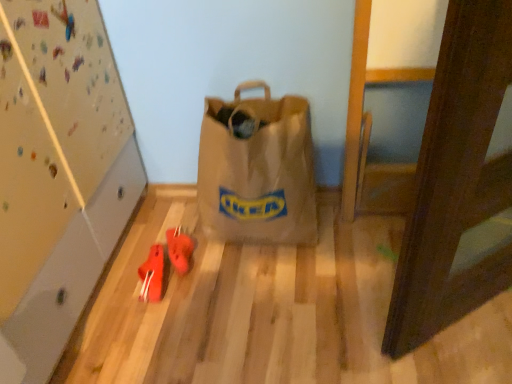
Question: Is brown paper bag at center taller than rubberized red shoes at lower left, acting as the 2th footwear starting from the right?

Choices:
 (A) no
 (B) yes

Answer: (B)

Question: Considering the relative sizes of brown paper bag at center and rubberized red shoes at lower left, the first footwear when ordered from left to right, in the image provided, is brown paper bag at center smaller than rubberized red shoes at lower left, the first footwear when ordered from left to right,?

Choices:
 (A) no
 (B) yes

Answer: (A)

Question: From the image's perspective, is brown paper bag at center beneath rubberized red shoes at lower left, acting as the 2th footwear starting from the right?

Choices:
 (A) yes
 (B) no

Answer: (B)

Question: Considering the relative positions of brown paper bag at center and rubberized red shoes at lower left, acting as the 2th footwear starting from the right, in the image provided, is brown paper bag at center behind rubberized red shoes at lower left, acting as the 2th footwear starting from the right,?

Choices:
 (A) no
 (B) yes

Answer: (A)

Question: Can you confirm if brown paper bag at center is positioned to the right of rubberized red shoes at lower left, the first footwear when ordered from left to right?

Choices:
 (A) no
 (B) yes

Answer: (B)

Question: Is brown paper bag at center wider than rubberized red shoes at lower left, acting as the 2th footwear starting from the right?

Choices:
 (A) no
 (B) yes

Answer: (B)

Question: Considering the relative sizes of rubberized red shoes at center, the 2th footwear viewed from the left, and rubberized red shoes at lower left, the first footwear when ordered from left to right, in the image provided, is rubberized red shoes at center, the 2th footwear viewed from the left, thinner than rubberized red shoes at lower left, the first footwear when ordered from left to right,?

Choices:
 (A) no
 (B) yes

Answer: (A)

Question: Can you confirm if rubberized red shoes at center, which is counted as the 1th footwear, starting from the right, is smaller than rubberized red shoes at lower left, the first footwear when ordered from left to right?

Choices:
 (A) yes
 (B) no

Answer: (A)

Question: Is there a large distance between rubberized red shoes at center, which is counted as the 1th footwear, starting from the right, and rubberized red shoes at lower left, acting as the 2th footwear starting from the right?

Choices:
 (A) no
 (B) yes

Answer: (A)

Question: Is rubberized red shoes at lower left, the first footwear when ordered from left to right, located within rubberized red shoes at center, the 2th footwear viewed from the left?

Choices:
 (A) no
 (B) yes

Answer: (A)

Question: Does rubberized red shoes at center, the 2th footwear viewed from the left, turn towards rubberized red shoes at lower left, acting as the 2th footwear starting from the right?

Choices:
 (A) no
 (B) yes

Answer: (A)

Question: Is rubberized red shoes at center, which is counted as the 1th footwear, starting from the right, further to camera compared to rubberized red shoes at lower left, the first footwear when ordered from left to right?

Choices:
 (A) yes
 (B) no

Answer: (A)

Question: Is rubberized red shoes at lower left, the first footwear when ordered from left to right, taller than rubberized red shoes at center, which is counted as the 1th footwear, starting from the right?

Choices:
 (A) yes
 (B) no

Answer: (A)